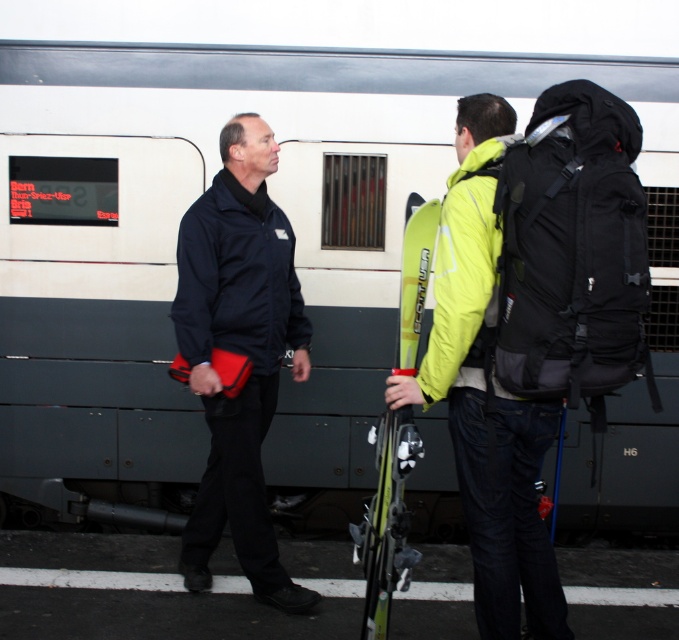
Measure the distance between black matte jacket at center and camera.

3.47 meters

Identify the location of black matte jacket at center. The height and width of the screenshot is (640, 679). (238, 353).

Is neon yellow jacket at center to the left of yellow matte ski at center from the viewer's perspective?

No, neon yellow jacket at center is not to the left of yellow matte ski at center.

Consider the image. Is neon yellow jacket at center positioned behind yellow matte ski at center?

No, neon yellow jacket at center is closer to the viewer.

Image resolution: width=679 pixels, height=640 pixels. I want to click on neon yellow jacket at center, so click(485, 394).

Is the position of black matte jacket at center less distant than that of yellow matte ski at center?

No, it is behind yellow matte ski at center.

What do you see at coordinates (238, 353) in the screenshot? I see `black matte jacket at center` at bounding box center [238, 353].

The width and height of the screenshot is (679, 640). I want to click on black matte jacket at center, so click(x=238, y=353).

Locate an element on the screen. This screenshot has height=640, width=679. black matte jacket at center is located at coordinates (238, 353).